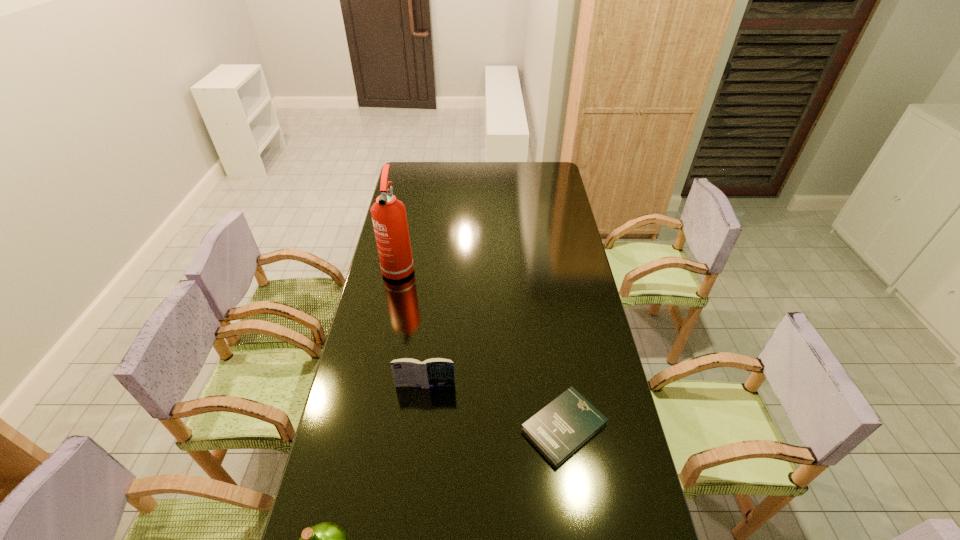
Locate an element on the screen. This screenshot has width=960, height=540. the tallest object is located at coordinates (389, 218).

What are the coordinates of `fire extinguisher` in the screenshot? It's located at point(389,218).

Identify the location of the taller book. (432, 372).

You are a GUI agent. You are given a task and a screenshot of the screen. Output one action in this format:
    pyautogui.click(x=<x>, y=<y>)
    Task: Click on the second shortest object
    
    Given the screenshot: What is the action you would take?
    pyautogui.click(x=432, y=372)

Locate an element on the screen. The height and width of the screenshot is (540, 960). the shorter book is located at coordinates (563, 426).

You are a GUI agent. You are given a task and a screenshot of the screen. Output one action in this format:
    pyautogui.click(x=<x>, y=<y>)
    Task: Click on the shortest object
    
    Given the screenshot: What is the action you would take?
    pyautogui.click(x=563, y=426)

Image resolution: width=960 pixels, height=540 pixels. Identify the location of free point located 0.340m at the nozzle of the tallest object. (382, 350).

At what (x,y) coordinates should I click in order to perform the action: click on free point located on the front cover of the second shortest object. Please return your answer as a coordinate pair (x, y). Looking at the image, I should click on (423, 402).

The height and width of the screenshot is (540, 960). I want to click on vacant space located on the back of the rightmost object, so click(551, 342).

Where is `fire extinguisher situated at the left edge`? This screenshot has height=540, width=960. fire extinguisher situated at the left edge is located at coordinates (389, 218).